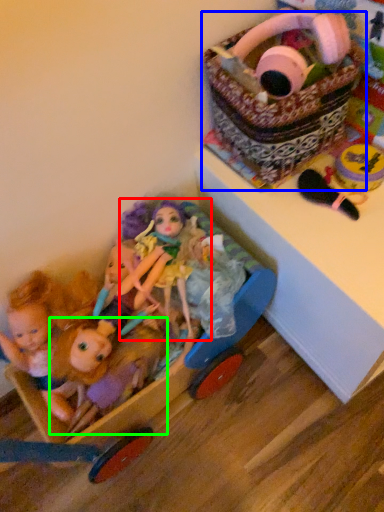
Question: Based on their relative distances, which object is nearer to doll (highlighted by a red box)? Choose from basket (highlighted by a blue box) and doll (highlighted by a green box).

Choices:
 (A) basket
 (B) doll

Answer: (B)